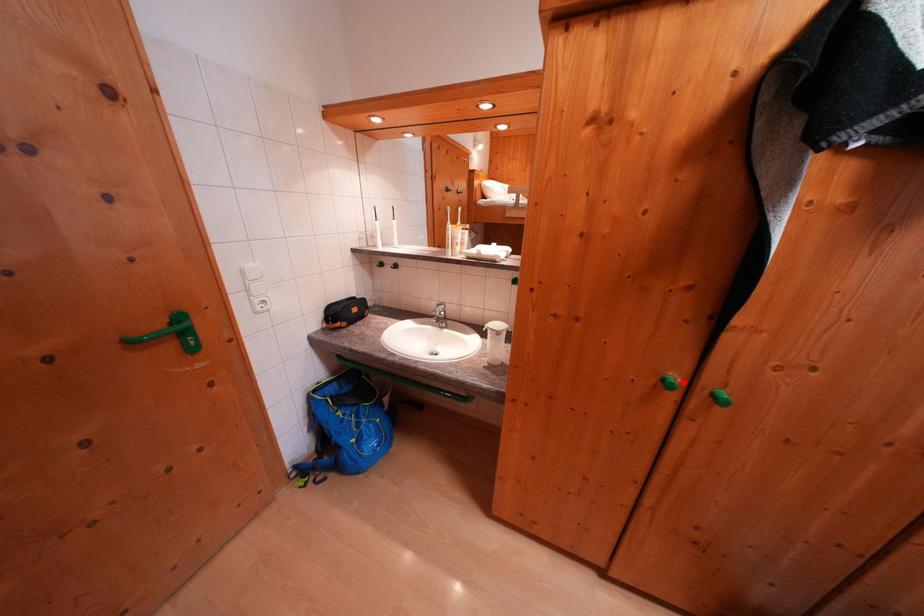
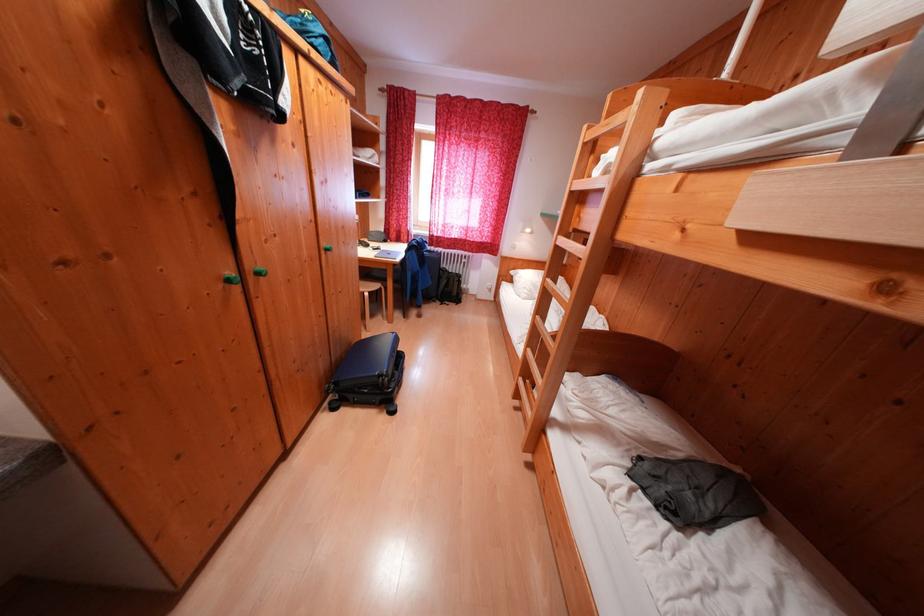
Find the pixel in the second image that matches the highlighted location in the first image.

(238, 278)